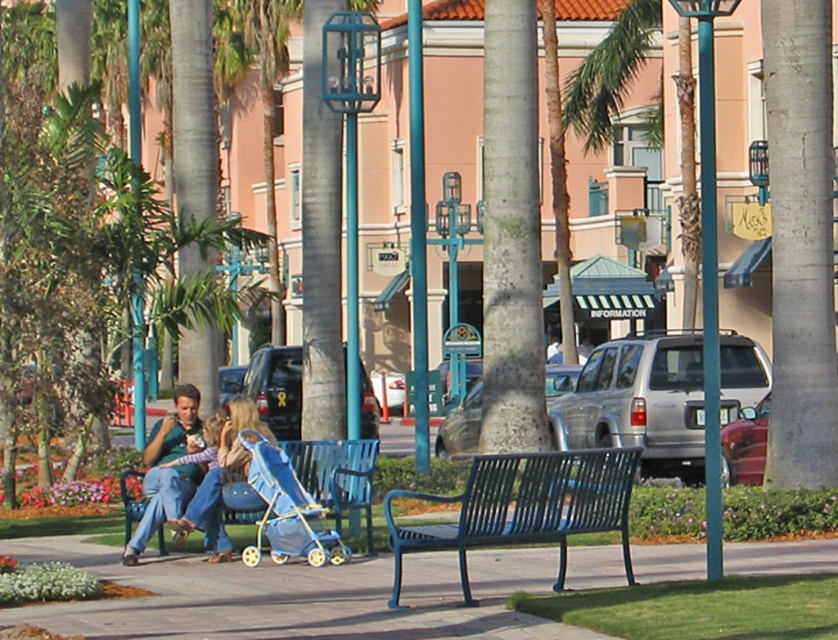
Which is below, smooth concrete pavement at center or denim jeans at center?

smooth concrete pavement at center is below.

Who is shorter, smooth concrete pavement at center or denim jeans at center?

Standing shorter between the two is smooth concrete pavement at center.

Between point (112, 600) and point (221, 538), which one is positioned behind?

The point (221, 538) is behind.

Where is `smooth concrete pavement at center`? This screenshot has height=640, width=838. smooth concrete pavement at center is located at coordinates (296, 596).

Measure the distance from blue metal bench at center to denim jeans at center.

3.13 meters

Does blue metal bench at center come in front of denim jeans at center?

Yes, it is.

Does point (448, 540) come behind point (229, 470)?

No, it is in front of (229, 470).

Identify the location of blue metal bench at center. (523, 508).

Between smooth concrete pavement at center and blue metal bench at center, which one appears on the right side from the viewer's perspective?

From the viewer's perspective, blue metal bench at center appears more on the right side.

Which is behind, point (536, 570) or point (495, 476)?

Positioned behind is point (536, 570).

Identify the location of smooth concrete pavement at center. This screenshot has width=838, height=640. (296, 596).